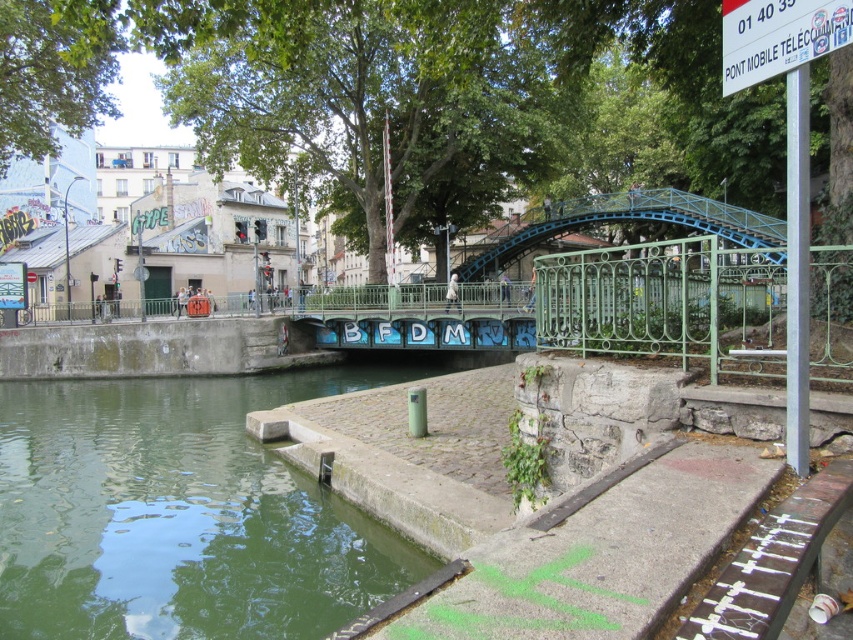
Is green concrete river at lower left shorter than white plastic sign at upper right?

No, green concrete river at lower left is not shorter than white plastic sign at upper right.

Which of these two, green concrete river at lower left or white plastic sign at upper right, stands shorter?

With less height is white plastic sign at upper right.

Find the location of `green concrete river at lower left`. green concrete river at lower left is located at coordinates (183, 512).

Is green wrought iron railing at center positioned before green wrought iron bridge at center?

That is True.

Does green wrought iron railing at center have a lesser width compared to green wrought iron bridge at center?

Yes, green wrought iron railing at center is thinner than green wrought iron bridge at center.

The height and width of the screenshot is (640, 853). In order to click on green wrought iron railing at center in this screenshot , I will do `click(666, 304)`.

Does green wrought iron bridge at center appear on the left side of white plastic sign at upper right?

No, green wrought iron bridge at center is not to the left of white plastic sign at upper right.

Which is more to the right, green wrought iron bridge at center or white plastic sign at upper right?

Positioned to the right is green wrought iron bridge at center.

What are the coordinates of `green wrought iron bridge at center` in the screenshot? It's located at (630, 221).

This screenshot has height=640, width=853. What are the coordinates of `green wrought iron bridge at center` in the screenshot? It's located at (630, 221).